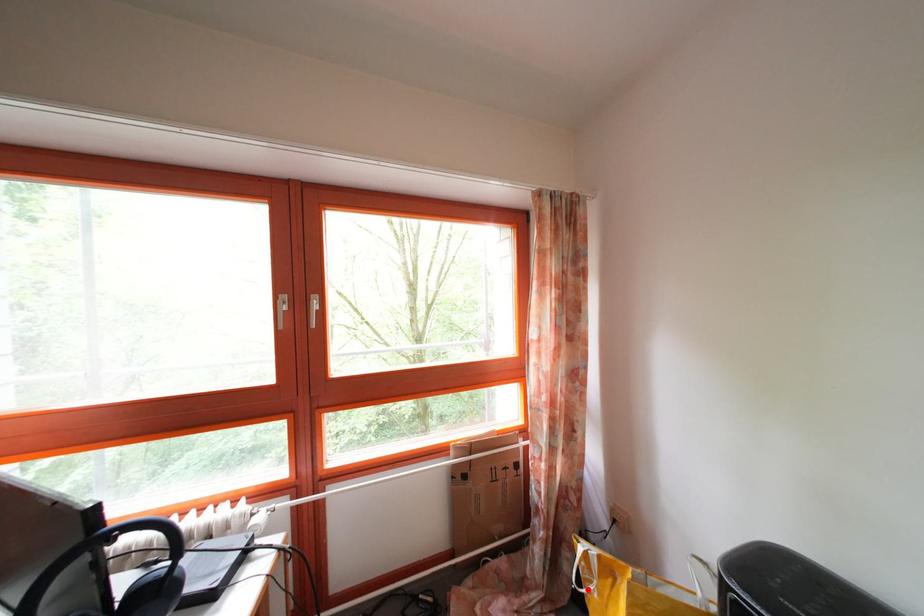
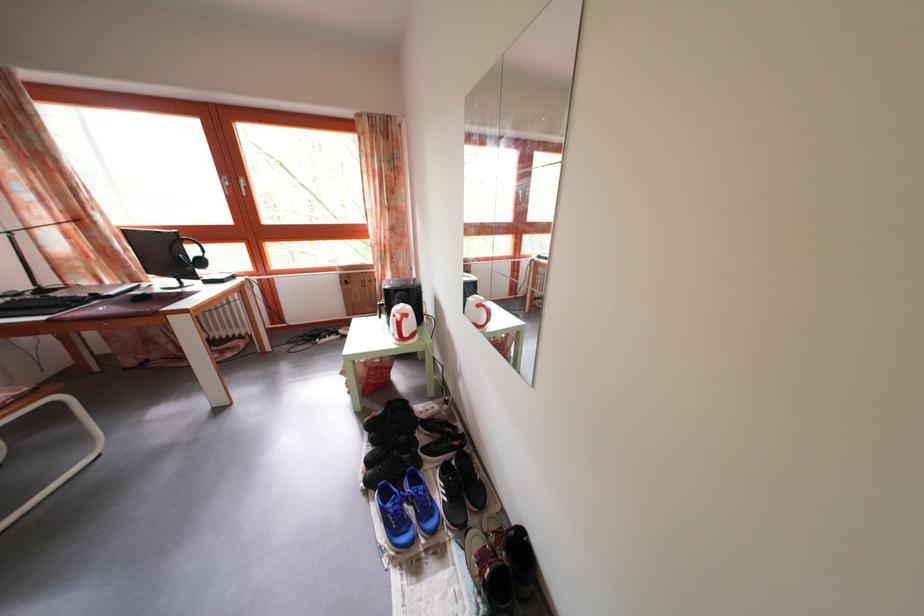
Question: I am providing you with two images of the same scene from different viewpoints. A red point is marked on the first image. At the location where the point appears in image 1, is it still visible in image 2?

Choices:
 (A) Yes
 (B) No

Answer: (B)